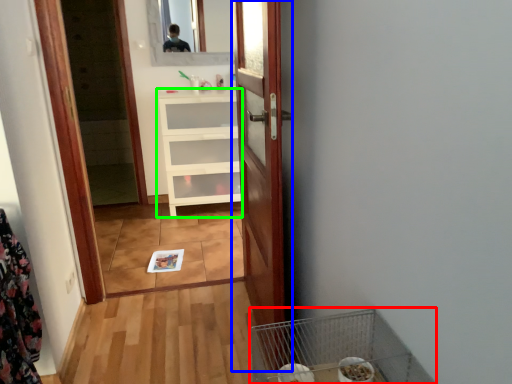
Question: Based on their relative distances, which object is nearer to bird cage (highlighted by a red box)? Choose from door (highlighted by a blue box) and cabinetry (highlighted by a green box).

Choices:
 (A) door
 (B) cabinetry

Answer: (A)